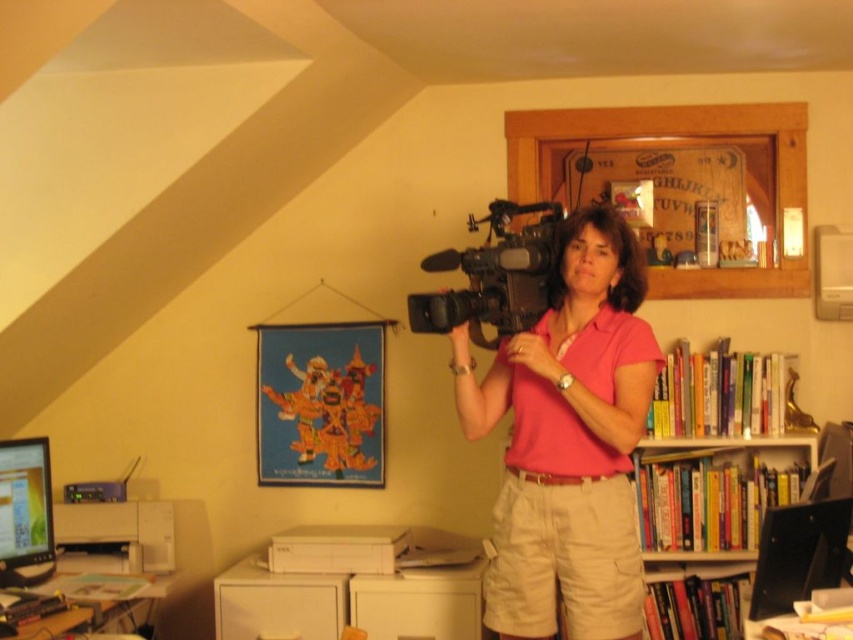
Between hardcover books at right and matte black monitor at lower left, which one is positioned lower?

matte black monitor at lower left

Is point (636, 492) positioned before point (0, 467)?

No, it is behind (0, 467).

Which is in front, point (674, 467) or point (51, 506)?

Point (51, 506)

I want to click on hardcover books at right, so click(712, 493).

Can you confirm if pink cotton shirt at center is positioned to the left of white plastic printer at lower left?

In fact, pink cotton shirt at center is to the right of white plastic printer at lower left.

Where is `pink cotton shirt at center`? The height and width of the screenshot is (640, 853). pink cotton shirt at center is located at coordinates (567, 440).

Locate an element on the screen. This screenshot has width=853, height=640. pink cotton shirt at center is located at coordinates (567, 440).

Image resolution: width=853 pixels, height=640 pixels. What are the coordinates of `pink cotton shirt at center` in the screenshot? It's located at (567, 440).

Based on the photo, between pink cotton shirt at center and white plastic computer desk at lower left, which one has more height?

Standing taller between the two is pink cotton shirt at center.

Who is positioned more to the right, pink cotton shirt at center or white plastic computer desk at lower left?

pink cotton shirt at center

Is point (624, 465) positioned after point (154, 600)?

That is False.

At what (x,y) coordinates should I click in order to perform the action: click on pink cotton shirt at center. Please return your answer as a coordinate pair (x, y). The image size is (853, 640). Looking at the image, I should click on (567, 440).